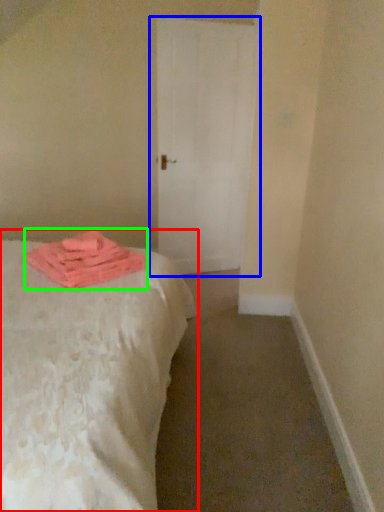
Question: Which is nearer to the bed (highlighted by a red box)? door (highlighted by a blue box) or material (highlighted by a green box).

Choices:
 (A) door
 (B) material

Answer: (B)